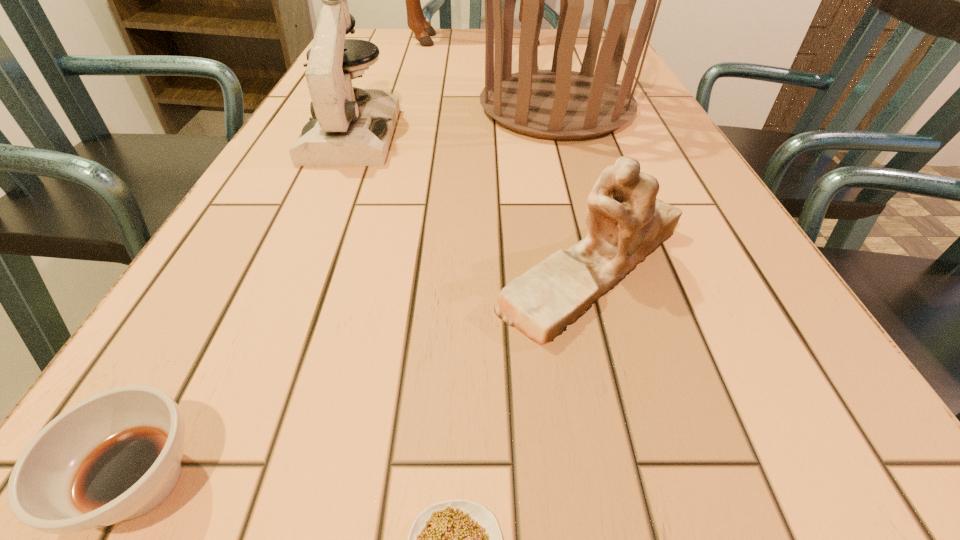
Where is `saddle`? This screenshot has width=960, height=540. saddle is located at coordinates (416, 21).

Where is `birdcage`? This screenshot has height=540, width=960. birdcage is located at coordinates (559, 104).

You are a GUI agent. You are given a task and a screenshot of the screen. Output one action in this format:
    pyautogui.click(x=<x>, y=<y>)
    Task: Click on the microscope
    
    Given the screenshot: What is the action you would take?
    pyautogui.click(x=348, y=126)

At what (x,y) coordinates should I click in order to perform the action: click on the third nearest object. Please return your answer as a coordinate pair (x, y). The image size is (960, 540). Looking at the image, I should click on (626, 223).

I want to click on figurine, so click(626, 223).

Locate an element on the screen. free region located 0.340m on the back of the farthest object is located at coordinates (515, 100).

The height and width of the screenshot is (540, 960). In order to click on vacant region located on the back of the birdcage in this screenshot , I will do `click(539, 43)`.

This screenshot has height=540, width=960. In order to click on vacant space positioned at the eyepiece of the microscope in this screenshot , I will do `click(263, 344)`.

In order to click on vacant space located 0.400m on the front-facing side of the third nearest object in this screenshot , I will do `click(205, 269)`.

Locate an element on the screen. blank space located 0.240m on the front-facing side of the third nearest object is located at coordinates (320, 269).